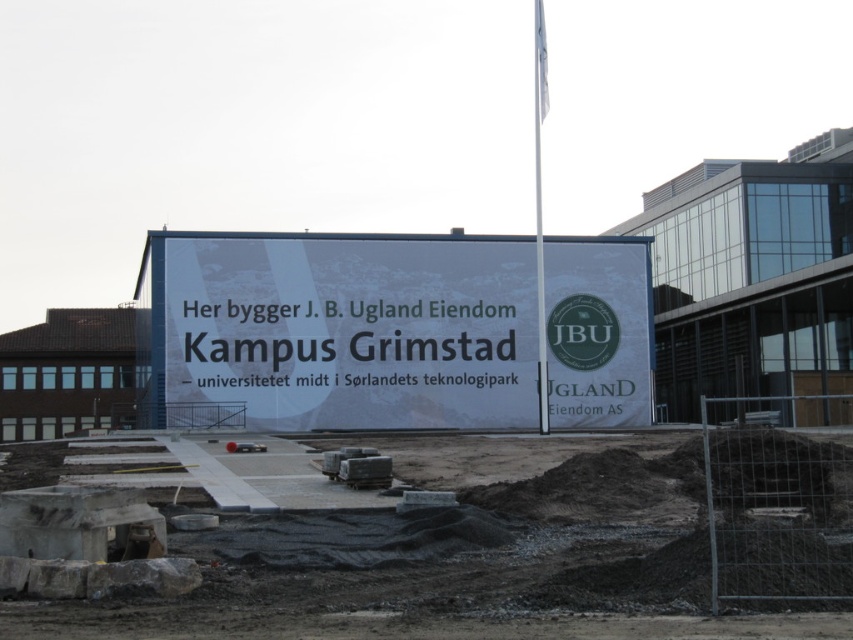
Question: Does concrete paving at center have a greater width compared to white paper billboard at center?

Choices:
 (A) no
 (B) yes

Answer: (A)

Question: Which object appears closest to the camera in this image?

Choices:
 (A) concrete paving at center
 (B) white paper billboard at center

Answer: (A)

Question: Can you confirm if concrete paving at center is positioned to the right of white paper billboard at center?

Choices:
 (A) no
 (B) yes

Answer: (B)

Question: Which object appears closest to the camera in this image?

Choices:
 (A) white paper billboard at center
 (B) concrete paving at center

Answer: (B)

Question: In this image, where is concrete paving at center located relative to white paper billboard at center?

Choices:
 (A) left
 (B) right

Answer: (B)

Question: Which of the following is the closest to the observer?

Choices:
 (A) (602, 285)
 (B) (564, 467)

Answer: (B)